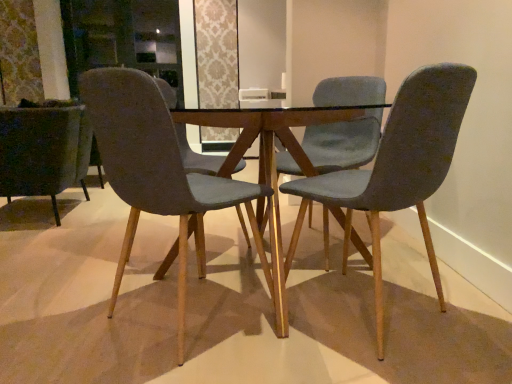
Question: From a real-world perspective, is velvet dark green armchair at left, which is the 4th chair in right-to-left order, on top of velvet grey chair at right, which appears as the first chair when viewed from the right?

Choices:
 (A) no
 (B) yes

Answer: (A)

Question: Is velvet dark green armchair at left, marked as the first chair in a left-to-right arrangement, oriented away from velvet grey chair at right, which appears as the first chair when viewed from the right?

Choices:
 (A) yes
 (B) no

Answer: (B)

Question: Is velvet dark green armchair at left, which is the 4th chair in right-to-left order, aimed at velvet grey chair at right, which appears as the first chair when viewed from the right?

Choices:
 (A) yes
 (B) no

Answer: (B)

Question: Is velvet dark green armchair at left, which is the 4th chair in right-to-left order, outside velvet grey chair at right, the 4th chair from the left?

Choices:
 (A) yes
 (B) no

Answer: (A)

Question: Are velvet dark green armchair at left, marked as the first chair in a left-to-right arrangement, and velvet grey chair at right, the 4th chair from the left, beside each other?

Choices:
 (A) yes
 (B) no

Answer: (B)

Question: Is velvet dark green armchair at left, which is the 4th chair in right-to-left order, not close to velvet grey chair at right, which appears as the first chair when viewed from the right?

Choices:
 (A) no
 (B) yes

Answer: (B)

Question: Is velvet grey chair at center, the 2th chair from the left, to the left of velvet dark green armchair at left, marked as the first chair in a left-to-right arrangement, from the viewer's perspective?

Choices:
 (A) no
 (B) yes

Answer: (A)

Question: From a real-world perspective, does velvet grey chair at center, the 2th chair from the left, stand above velvet dark green armchair at left, marked as the first chair in a left-to-right arrangement?

Choices:
 (A) no
 (B) yes

Answer: (B)

Question: Is velvet grey chair at center, which is the third chair in right-to-left order, positioned beyond the bounds of velvet dark green armchair at left, marked as the first chair in a left-to-right arrangement?

Choices:
 (A) no
 (B) yes

Answer: (B)

Question: Is velvet grey chair at center, which is the third chair in right-to-left order, shorter than velvet dark green armchair at left, marked as the first chair in a left-to-right arrangement?

Choices:
 (A) yes
 (B) no

Answer: (B)

Question: Considering the relative sizes of velvet grey chair at center, which is the third chair in right-to-left order, and velvet dark green armchair at left, which is the 4th chair in right-to-left order, in the image provided, is velvet grey chair at center, which is the third chair in right-to-left order, taller than velvet dark green armchair at left, which is the 4th chair in right-to-left order,?

Choices:
 (A) yes
 (B) no

Answer: (A)

Question: Can you confirm if velvet grey chair at center, the 2th chair from the left, is positioned to the right of velvet dark green armchair at left, marked as the first chair in a left-to-right arrangement?

Choices:
 (A) no
 (B) yes

Answer: (B)

Question: Is velvet dark green armchair at left, which is the 4th chair in right-to-left order, touching velvet grey chair at center, the 2th chair from the left?

Choices:
 (A) yes
 (B) no

Answer: (B)